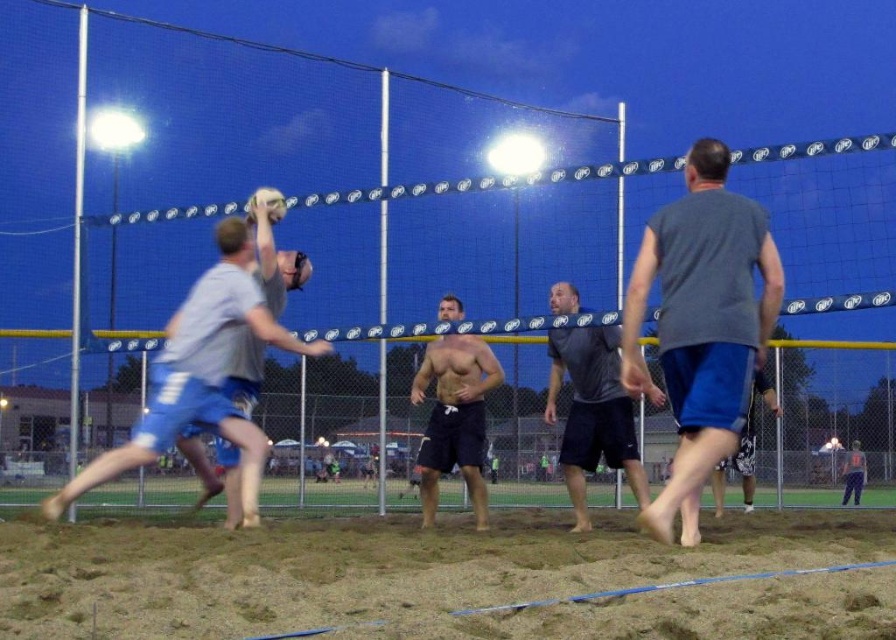
Between gray fabric shirt at left and shiny black shorts at center, which one has more height?

Standing taller between the two is gray fabric shirt at left.

Can you confirm if gray fabric shirt at left is positioned to the left of shiny black shorts at center?

Indeed, gray fabric shirt at left is positioned on the left side of shiny black shorts at center.

Does point (222, 310) come closer to viewer compared to point (484, 528)?

Yes, it is.

You are a GUI agent. You are given a task and a screenshot of the screen. Output one action in this format:
    pyautogui.click(x=<x>, y=<y>)
    Task: Click on the gray fabric shirt at left
    
    Given the screenshot: What is the action you would take?
    pyautogui.click(x=201, y=376)

Measure the distance from shiny black shorts at center to dark blue shorts at lower right.

The distance of shiny black shorts at center from dark blue shorts at lower right is 6.15 meters.

Does point (476, 497) come in front of point (851, 474)?

Yes, it is.

What do you see at coordinates (454, 419) in the screenshot? I see `shiny black shorts at center` at bounding box center [454, 419].

Image resolution: width=896 pixels, height=640 pixels. I want to click on shiny black shorts at center, so click(x=454, y=419).

Does brown sandy beach at lower center have a larger size compared to dark blue shorts at lower right?

No.

Can you confirm if brown sandy beach at lower center is positioned to the right of dark blue shorts at lower right?

Incorrect, brown sandy beach at lower center is not on the right side of dark blue shorts at lower right.

Who is more distant from viewer, [376,525] or [858,492]?

The point [858,492] is more distant.

The height and width of the screenshot is (640, 896). What are the coordinates of `brown sandy beach at lower center` in the screenshot? It's located at (448, 580).